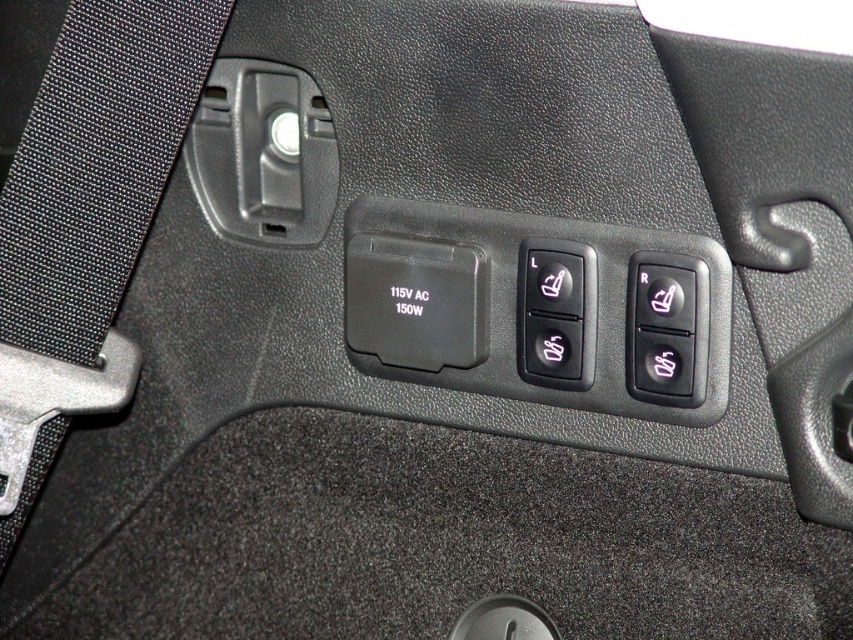
Question: Which of the following is the farthest from the observer?

Choices:
 (A) black plastic button at center
 (B) black fabric seatbelt at left
 (C) black plastic seat adjustment button at right

Answer: (A)

Question: In this image, where is black plastic button at center located relative to black plastic seat adjustment button at right?

Choices:
 (A) below
 (B) above

Answer: (B)

Question: Observing the image, what is the correct spatial positioning of black plastic button at center in reference to black plastic seat adjustment button at right?

Choices:
 (A) below
 (B) above

Answer: (B)

Question: In this image, where is black plastic button at center located relative to black plastic seat adjustment button at right?

Choices:
 (A) right
 (B) left

Answer: (B)

Question: Which of these objects is positioned farthest from the black fabric seatbelt at left?

Choices:
 (A) black plastic seat adjustment button at right
 (B) black plastic button at center

Answer: (A)

Question: Among these objects, which one is farthest from the camera?

Choices:
 (A) black plastic button at center
 (B) black fabric seatbelt at left
 (C) black plastic seat adjustment button at right

Answer: (A)